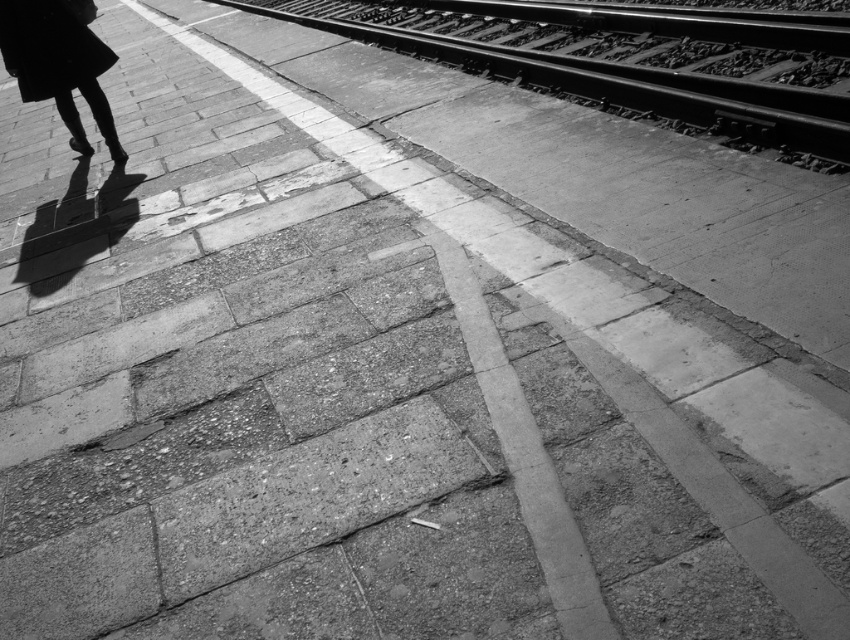
Question: Is smooth metal train track at upper right positioned behind silhouette dress at left?

Choices:
 (A) no
 (B) yes

Answer: (A)

Question: Does smooth metal train track at upper right appear on the left side of silhouette dress at left?

Choices:
 (A) no
 (B) yes

Answer: (A)

Question: Which of the following is the farthest from the observer?

Choices:
 (A) (550, 54)
 (B) (91, 96)

Answer: (A)

Question: Which object appears closest to the camera in this image?

Choices:
 (A) silhouette dress at left
 (B) smooth metal train track at upper right

Answer: (B)

Question: Does smooth metal train track at upper right appear over silhouette dress at left?

Choices:
 (A) no
 (B) yes

Answer: (B)

Question: Which of the following is the farthest from the observer?

Choices:
 (A) smooth metal train track at upper right
 (B) silhouette dress at left

Answer: (B)